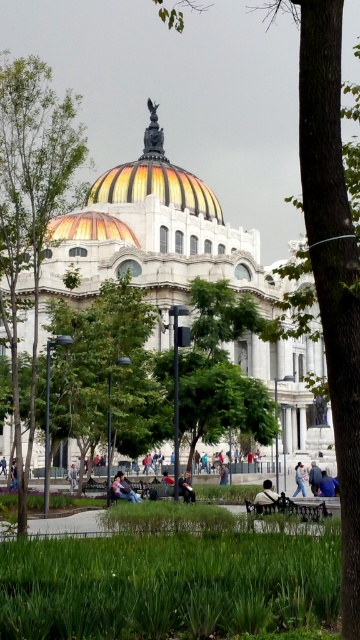
Who is more distant from viewer, (x=268, y=508) or (x=302, y=465)?

Positioned behind is point (x=302, y=465).

Does wooden park bench at lower center lie in front of light blue jeans at center?

Yes, wooden park bench at lower center is closer to the viewer.

Is point (297, 515) more distant than point (304, 496)?

No.

This screenshot has height=640, width=360. What are the coordinates of `wooden park bench at lower center` in the screenshot? It's located at (290, 508).

Can you confirm if denim jacket at lower right is bigger than light brown wooden bench at center?

No.

This screenshot has height=640, width=360. What are the coordinates of `denim jacket at lower right` in the screenshot? It's located at click(315, 477).

Find the location of a particular element. denim jacket at lower right is located at coordinates (315, 477).

Can you confirm if green grass at lower center is bigger than denim jacket at lower right?

Yes.

From the picture: Who is more forward, (6, 547) or (311, 464)?

Positioned in front is point (6, 547).

Between point (261, 602) and point (316, 490), which one is positioned in front?

Point (261, 602) is in front.

Locate an element on the screen. This screenshot has width=360, height=640. green grass at lower center is located at coordinates (167, 586).